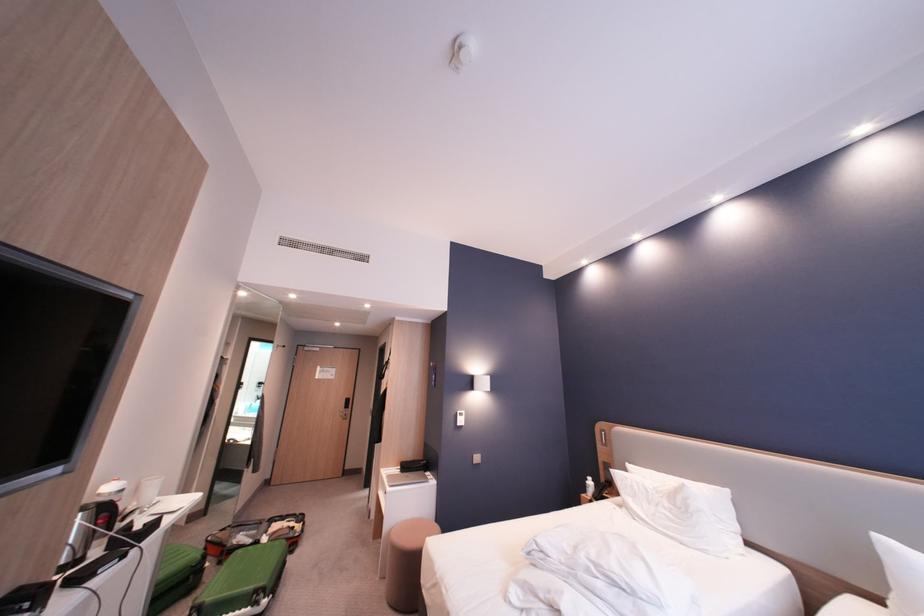
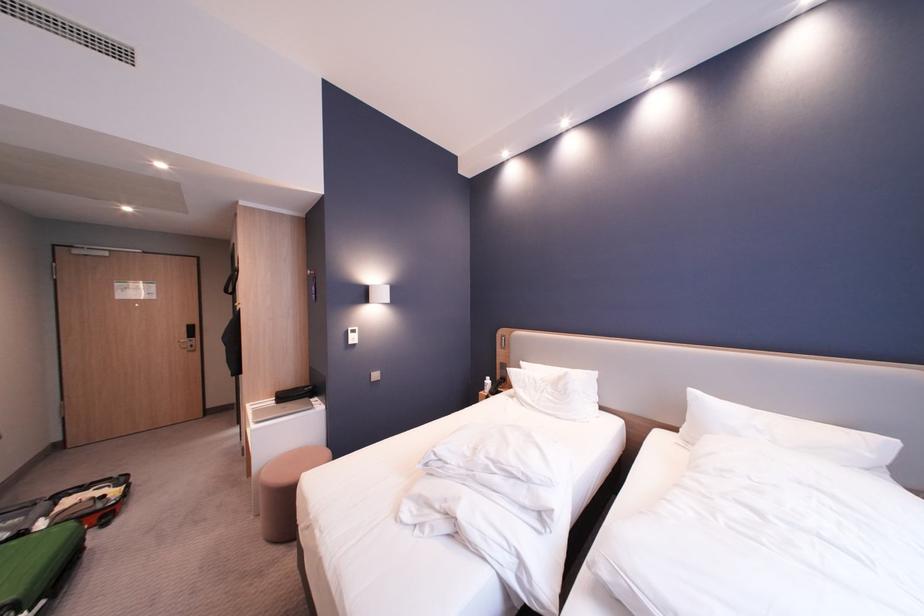
Where in the second image is the point corresponding to (x=350, y=411) from the first image?

(189, 342)